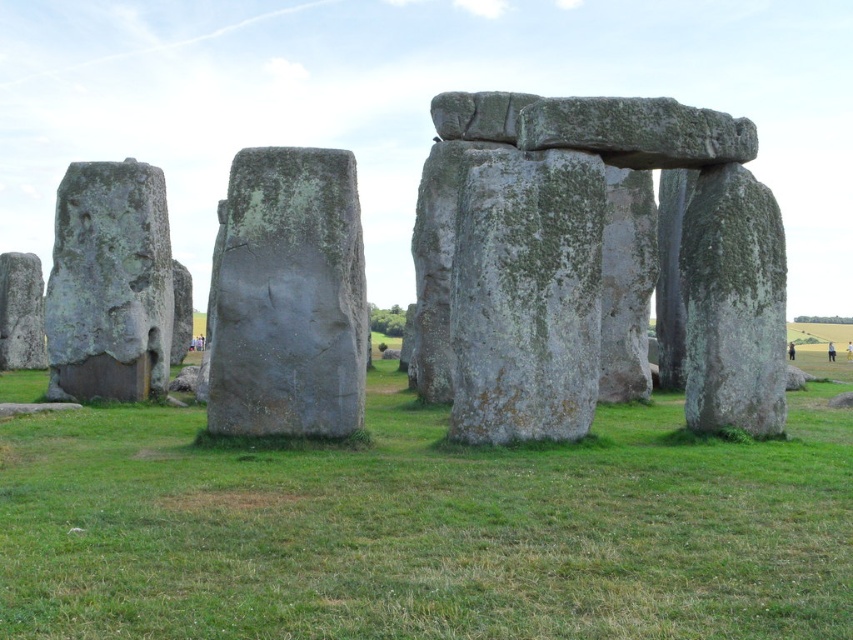
Is gray stone structure at center to the left of gray rough stone face at left from the viewer's perspective?

In fact, gray stone structure at center is to the right of gray rough stone face at left.

Is gray stone structure at center below gray rough stone face at left?

No.

The height and width of the screenshot is (640, 853). What are the coordinates of `gray stone structure at center` in the screenshot? It's located at (599, 260).

Find the location of a particular element. This screenshot has height=640, width=853. gray stone structure at center is located at coordinates (599, 260).

Between green grass at center and green mossy stone at center, which one appears on the left side from the viewer's perspective?

Positioned to the left is green mossy stone at center.

Who is higher up, green grass at center or green mossy stone at center?

Positioned higher is green mossy stone at center.

Does point (782, 582) come closer to viewer compared to point (328, 264)?

Yes, point (782, 582) is closer to viewer.

Locate an element on the screen. This screenshot has height=640, width=853. green grass at center is located at coordinates (427, 528).

Can you confirm if green mossy stone at center is shorter than gray rough stone face at left?

Correct, green mossy stone at center is not as tall as gray rough stone face at left.

Which is more to the right, green mossy stone at center or gray rough stone face at left?

From the viewer's perspective, green mossy stone at center appears more on the right side.

At what (x,y) coordinates should I click in order to perform the action: click on green mossy stone at center. Please return your answer as a coordinate pair (x, y). This screenshot has height=640, width=853. Looking at the image, I should click on (288, 298).